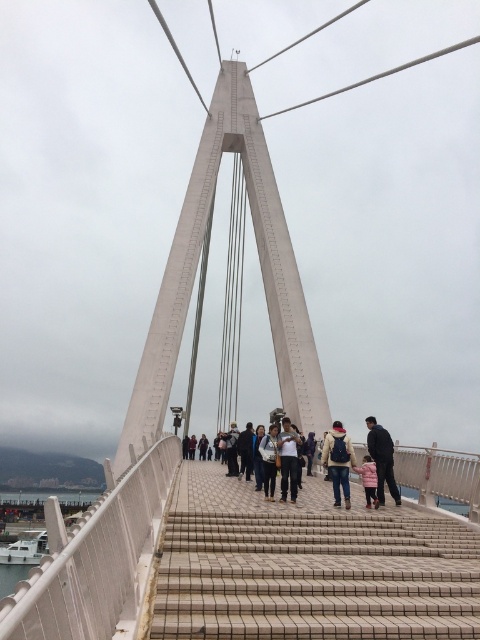
You are a photographer standing on the modern pedestrian bridge. You notice a person wearing a light brown leather jacket at center and dark gray pants at center. Which clothing item appears taller from your viewpoint?

The light brown leather jacket at center appears taller than the dark gray pants at center from the photographer viewpoint.

You are standing at the entrance of the pedestrian bridge and see a person wearing a light brown leather jacket at center. If you want to take a photo of them from the bridge entrance, which direction should you face?

The light brown leather jacket at center is located at point coordinates, so you should face towards the center of the bridge to capture the person in your photo.